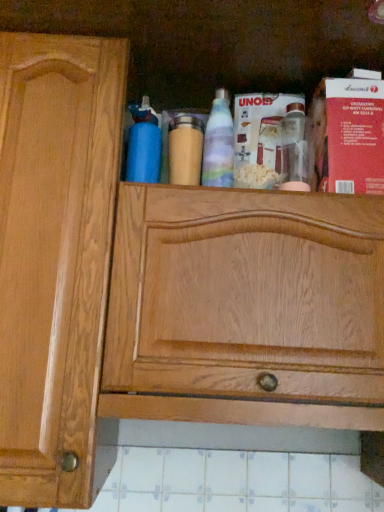
Question: Can you confirm if blue matte bottle at upper center, the 1th bottle in the left-to-right sequence, is thinner than wooden bottle at center, acting as the second bottle starting from the right?

Choices:
 (A) no
 (B) yes

Answer: (A)

Question: From a real-world perspective, is blue matte bottle at upper center, the third bottle viewed from the right, positioned over wooden bottle at center, which ranks as the second bottle in left-to-right order, based on gravity?

Choices:
 (A) yes
 (B) no

Answer: (A)

Question: Does blue matte bottle at upper center, the third bottle viewed from the right, have a greater width compared to wooden bottle at center, acting as the second bottle starting from the right?

Choices:
 (A) no
 (B) yes

Answer: (B)

Question: Does blue matte bottle at upper center, the third bottle viewed from the right, come in front of wooden bottle at center, acting as the second bottle starting from the right?

Choices:
 (A) no
 (B) yes

Answer: (B)

Question: Is blue matte bottle at upper center, the third bottle viewed from the right, positioned behind wooden bottle at center, which ranks as the second bottle in left-to-right order?

Choices:
 (A) yes
 (B) no

Answer: (B)

Question: Visually, is wooden bottle at center, acting as the second bottle starting from the right, positioned to the left or to the right of translucent plastic bottle at center, the first bottle viewed from the right?

Choices:
 (A) right
 (B) left

Answer: (B)

Question: From the image's perspective, is wooden bottle at center, which ranks as the second bottle in left-to-right order, located above or below translucent plastic bottle at center, the first bottle viewed from the right?

Choices:
 (A) above
 (B) below

Answer: (B)

Question: Looking at the image, does wooden bottle at center, which ranks as the second bottle in left-to-right order, seem bigger or smaller compared to translucent plastic bottle at center, positioned as the third bottle in left-to-right order?

Choices:
 (A) small
 (B) big

Answer: (A)

Question: Is wooden bottle at center, which ranks as the second bottle in left-to-right order, inside or outside of translucent plastic bottle at center, positioned as the third bottle in left-to-right order?

Choices:
 (A) inside
 (B) outside

Answer: (B)

Question: From their relative heights in the image, would you say translucent plastic bottle at center, positioned as the third bottle in left-to-right order, is taller or shorter than blue matte bottle at upper center, the 1th bottle in the left-to-right sequence?

Choices:
 (A) short
 (B) tall

Answer: (B)

Question: In the image, is translucent plastic bottle at center, the first bottle viewed from the right, positioned in front of or behind blue matte bottle at upper center, the third bottle viewed from the right?

Choices:
 (A) front
 (B) behind

Answer: (B)

Question: Considering the positions of point (231, 147) and point (155, 173), is point (231, 147) closer or farther from the camera than point (155, 173)?

Choices:
 (A) closer
 (B) farther

Answer: (B)

Question: From the image's perspective, is translucent plastic bottle at center, positioned as the third bottle in left-to-right order, above or below blue matte bottle at upper center, the third bottle viewed from the right?

Choices:
 (A) above
 (B) below

Answer: (A)

Question: Looking at their shapes, would you say blue matte bottle at upper center, the third bottle viewed from the right, is wider or thinner than wooden bottle at center, acting as the second bottle starting from the right?

Choices:
 (A) wide
 (B) thin

Answer: (A)

Question: Is blue matte bottle at upper center, the 1th bottle in the left-to-right sequence, bigger or smaller than wooden bottle at center, acting as the second bottle starting from the right?

Choices:
 (A) small
 (B) big

Answer: (B)